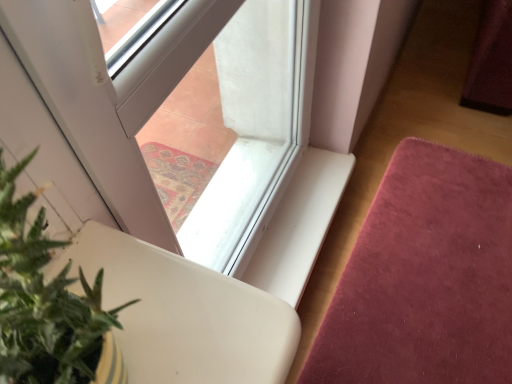
Question: From a real-world perspective, does velvet pink mat at lower right sit lower than transparent glass window at center?

Choices:
 (A) no
 (B) yes

Answer: (B)

Question: Does velvet pink mat at lower right have a lesser height compared to transparent glass window at center?

Choices:
 (A) yes
 (B) no

Answer: (A)

Question: Can you confirm if velvet pink mat at lower right is wider than transparent glass window at center?

Choices:
 (A) no
 (B) yes

Answer: (B)

Question: From the image's perspective, is velvet pink mat at lower right under transparent glass window at center?

Choices:
 (A) yes
 (B) no

Answer: (A)

Question: Would you say velvet pink mat at lower right is a long distance from transparent glass window at center?

Choices:
 (A) yes
 (B) no

Answer: (B)

Question: Could you tell me if velvet pink mat at lower right is facing transparent glass window at center?

Choices:
 (A) no
 (B) yes

Answer: (A)

Question: Does transparent glass window at center have a lesser height compared to velvet pink mat at lower right?

Choices:
 (A) no
 (B) yes

Answer: (A)

Question: Can we say transparent glass window at center lies outside velvet pink mat at lower right?

Choices:
 (A) yes
 (B) no

Answer: (A)

Question: From a real-world perspective, is transparent glass window at center positioned under velvet pink mat at lower right based on gravity?

Choices:
 (A) yes
 (B) no

Answer: (B)

Question: Does transparent glass window at center lie in front of velvet pink mat at lower right?

Choices:
 (A) yes
 (B) no

Answer: (A)

Question: Is transparent glass window at center wider than velvet pink mat at lower right?

Choices:
 (A) no
 (B) yes

Answer: (A)

Question: Considering the relative positions of transparent glass window at center and velvet pink mat at lower right in the image provided, is transparent glass window at center to the right of velvet pink mat at lower right from the viewer's perspective?

Choices:
 (A) yes
 (B) no

Answer: (B)

Question: From a real-world perspective, is green leafy plant at lower left physically below transparent glass window at center?

Choices:
 (A) yes
 (B) no

Answer: (B)